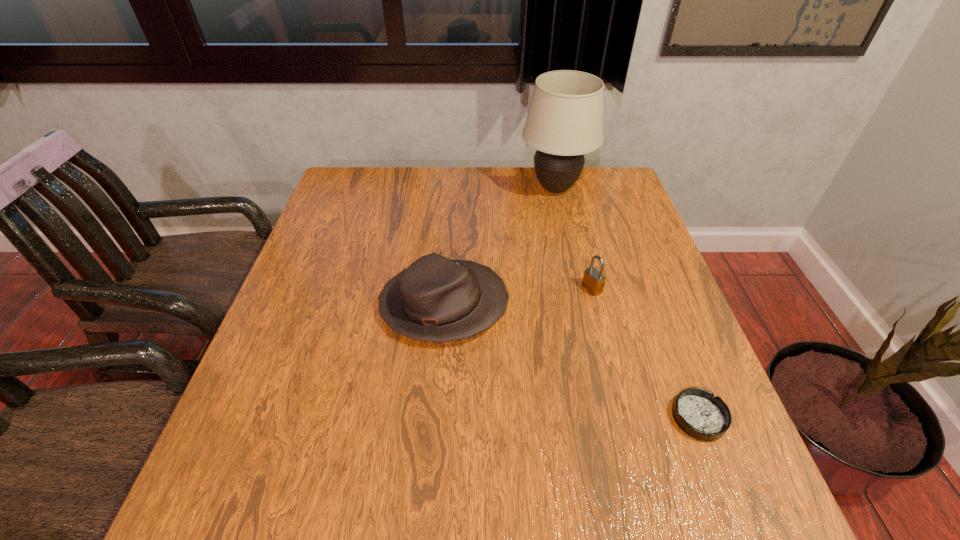
What are the coordinates of `object positioned at the far edge` in the screenshot? It's located at (565, 118).

What are the coordinates of `lampshade that is positioned at the right edge` in the screenshot? It's located at (565, 118).

The image size is (960, 540). Identify the location of ashtray positioned at the right edge. (697, 412).

Image resolution: width=960 pixels, height=540 pixels. Identify the location of object that is at the far right corner. (565, 118).

Image resolution: width=960 pixels, height=540 pixels. In order to click on vacant space at the far edge of the desktop in this screenshot , I will do `click(492, 192)`.

The image size is (960, 540). I want to click on free location at the near edge, so click(372, 500).

In the image, there is a desktop. At what (x,y) coordinates should I click in order to perform the action: click on vacant space at the left edge. Please return your answer as a coordinate pair (x, y). Looking at the image, I should click on (253, 384).

At what (x,y) coordinates should I click in order to perform the action: click on free space at the right edge. Please return your answer as a coordinate pair (x, y). This screenshot has width=960, height=540. Looking at the image, I should click on (649, 255).

Find the location of a particular element. This screenshot has height=540, width=960. vacant region at the far left corner of the desktop is located at coordinates (351, 190).

The image size is (960, 540). In order to click on free point between the padlock and the ashtray in this screenshot , I will do `click(645, 353)`.